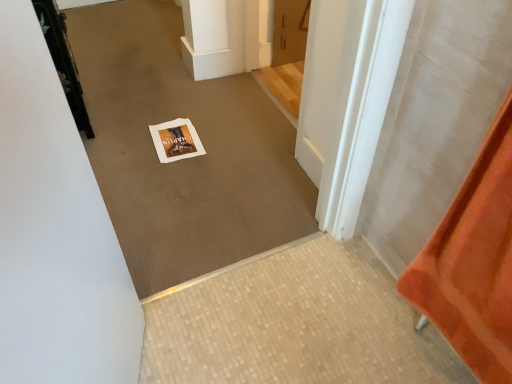
Identify the location of vacant area on top of white paper at center (from a real-world perspective). (176, 137).